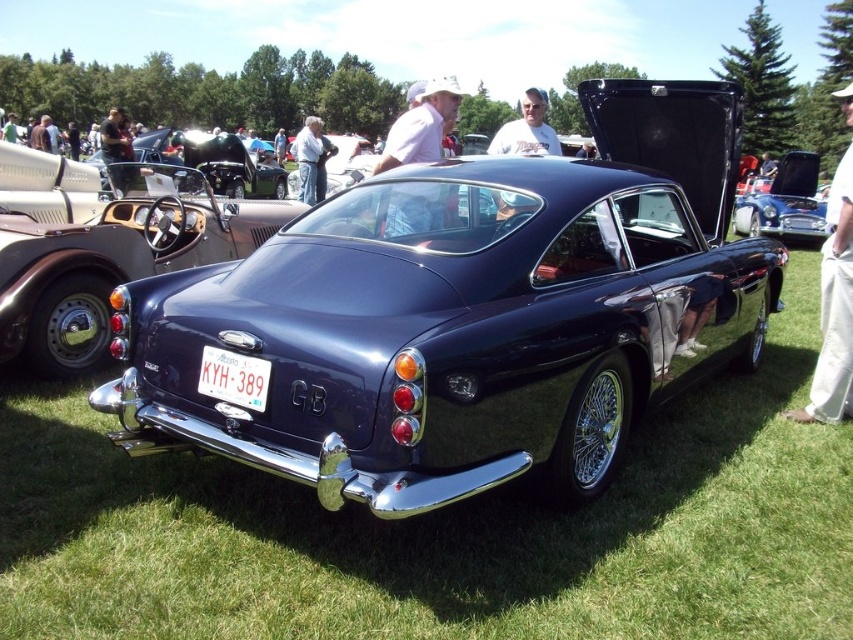
You are a photographer at the car show and want to capture the shiny black car at center and the white plastic license plate at center in the same frame. Which object should you position closer to the left side of your camera viewfinder?

The shiny black car at center should be positioned closer to the left side of the camera viewfinder because it is located to the left of the white plastic license plate at center.

You are a photographer planning to take a closeup shot of the glossy blue car at center and the white plastic license plate at center. Which object should you zoom in on to capture more details without moving the camera?

The white plastic license plate at center has a greater width than the glossy blue car at center, so zooming in on it would allow capturing more details without moving the camera.